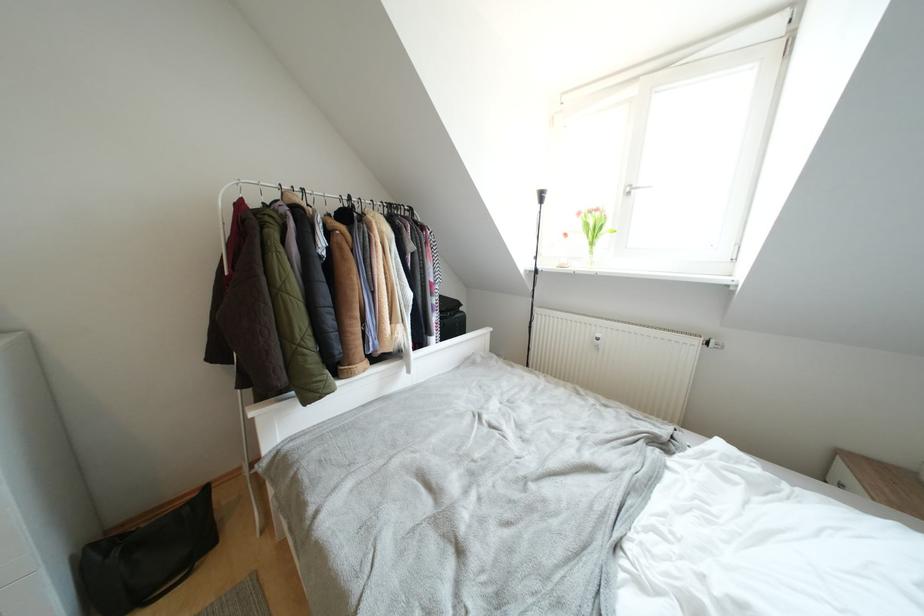
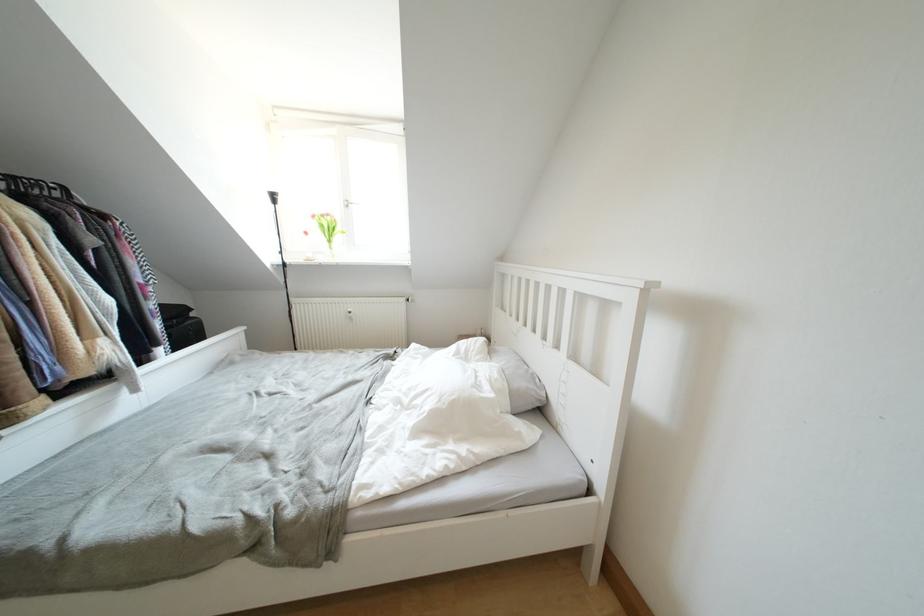
The point at (584,217) is marked in the first image. Where is the corresponding point in the second image?

(319, 220)